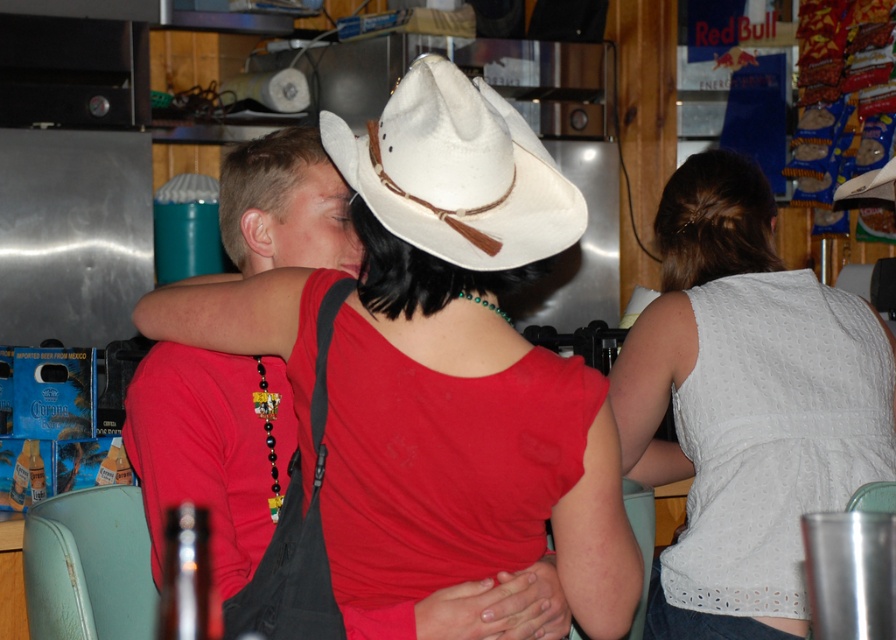
At what (x,y) coordinates should I click in order to perform the action: click on matte black shirt at center. Please return your answer as a coordinate pair (x, y). The height and width of the screenshot is (640, 896). Looking at the image, I should click on (210, 449).

Is matte black shirt at center wider than white felt cowboy hat at center?

In fact, matte black shirt at center might be narrower than white felt cowboy hat at center.

Is point (501, 589) more distant than point (402, 188)?

That is True.

In order to click on matte black shirt at center in this screenshot , I will do `click(210, 449)`.

Between point (832, 358) and point (380, 221), which one is positioned behind?

The point (832, 358) is behind.

Which is behind, point (636, 452) or point (466, 266)?

Point (636, 452)

What are the coordinates of `white lace tank top at center` in the screenshot? It's located at (746, 404).

Who is more distant from viewer, (843, 340) or (358, 262)?

The point (843, 340) is behind.

Which is behind, point (672, 563) or point (423, 628)?

The point (672, 563) is more distant.

Identify the location of white lace tank top at center. (746, 404).